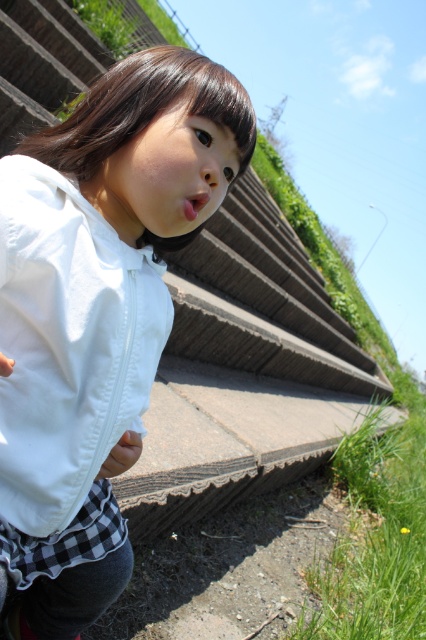
Question: Observing the image, what is the correct spatial positioning of white matte jacket at center in reference to white matte jacket at lower left?

Choices:
 (A) below
 (B) above

Answer: (A)

Question: Is white matte jacket at center positioned behind white matte jacket at lower left?

Choices:
 (A) yes
 (B) no

Answer: (B)

Question: Which point appears closest to the camera in this image?

Choices:
 (A) (92, 124)
 (B) (129, 320)

Answer: (B)

Question: From the image, what is the correct spatial relationship of white matte jacket at center in relation to white matte jacket at lower left?

Choices:
 (A) above
 (B) below

Answer: (B)